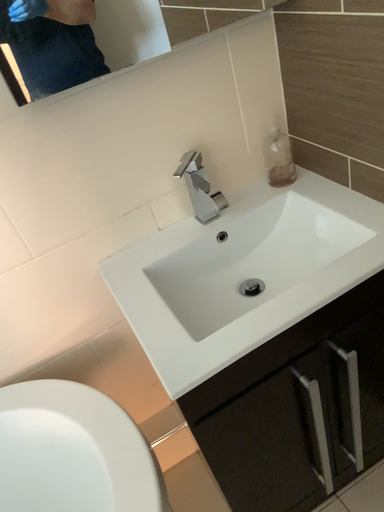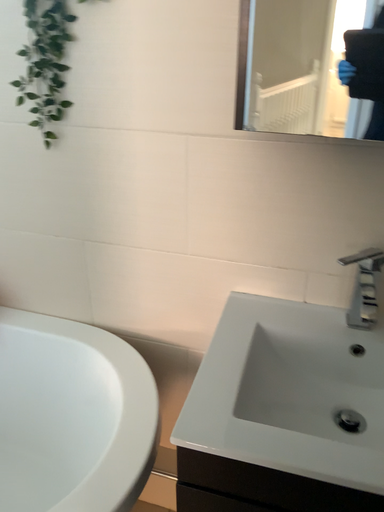
Question: How did the camera likely rotate when shooting the video?

Choices:
 (A) rotated upward
 (B) rotated downward

Answer: (A)